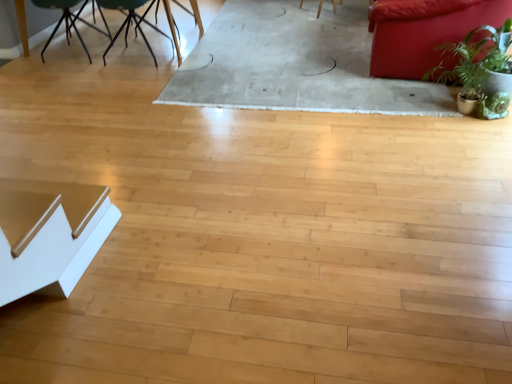
Question: Does point (123, 23) appear closer or farther from the camera than point (487, 115)?

Choices:
 (A) closer
 (B) farther

Answer: (B)

Question: Looking at their shapes, would you say green matte chair at upper left, which is the 2th chair in left-to-right order, is wider or thinner than green leafy plant at right?

Choices:
 (A) thin
 (B) wide

Answer: (B)

Question: Which object is the farthest from the green leafy plant at right?

Choices:
 (A) green matte chair at upper left, which ranks as the first chair in left-to-right order
 (B) white glossy table at lower left
 (C) green matte chair at upper left, which is the 1th chair in right-to-left order
 (D) metallic black table at upper left
 (E) matte red couch at upper right

Answer: (D)

Question: Based on their relative distances, which object is farther from the matte red couch at upper right?

Choices:
 (A) green matte chair at upper left, which ranks as the first chair in left-to-right order
 (B) green leafy plant at right
 (C) white glossy table at lower left
 (D) metallic black table at upper left
 (E) green matte chair at upper left, which is the 2th chair in left-to-right order

Answer: (D)